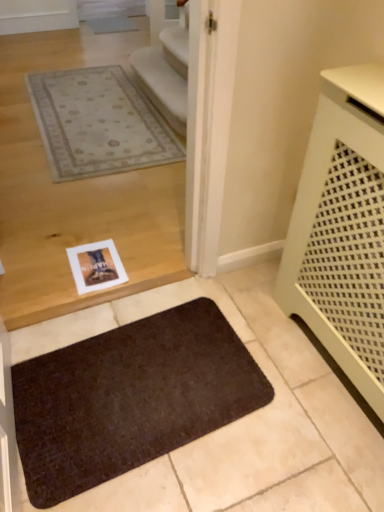
Where is `vacant space situated above brown textured mat at lower center (from a real-world perspective)`? This screenshot has width=384, height=512. vacant space situated above brown textured mat at lower center (from a real-world perspective) is located at coordinates (130, 381).